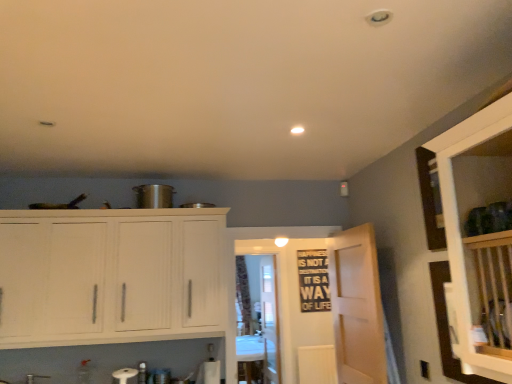
Describe the element at coordinates (269, 320) in the screenshot. I see `transparent glass door at center, placed as the first glass door when sorted from back to front` at that location.

You are a GUI agent. You are given a task and a screenshot of the screen. Output one action in this format:
    pyautogui.click(x=<x>, y=<y>)
    Task: Click on the transparent glass door at center, placed as the first glass door when sorted from back to front
    This screenshot has height=384, width=512.
    Given the screenshot: What is the action you would take?
    pyautogui.click(x=269, y=320)

What are the coordinates of `light wood door at center` in the screenshot? It's located at (357, 307).

The image size is (512, 384). I want to click on white wood cabinets at left, so click(x=110, y=276).

Find the location of a particular element. transparent glass door at center, which is counted as the 1th glass door, starting from the front is located at coordinates (264, 324).

Does light wood door at center have a smaller size compared to black matte bulletin board at center?

No, light wood door at center is not smaller than black matte bulletin board at center.

From the picture: Looking at their sizes, would you say light wood door at center is wider or thinner than black matte bulletin board at center?

In the image, light wood door at center appears to be wider than black matte bulletin board at center.

From a real-world perspective, is light wood door at center beneath black matte bulletin board at center?

Correct, in the physical world, light wood door at center is lower than black matte bulletin board at center.

From the image's perspective, which object appears higher, light wood door at center or black matte bulletin board at center?

From the image's view, light wood door at center is above.

Which is in front, transparent glass door at center, which is counted as the 1th glass door, starting from the front, or light wood door at center?

light wood door at center is in front.

From the image's perspective, between transparent glass door at center, arranged as the second glass door when viewed from the back, and light wood door at center, who is located below?

transparent glass door at center, arranged as the second glass door when viewed from the back, from the image's perspective.

Is transparent glass door at center, which is counted as the 1th glass door, starting from the front, turned away from light wood door at center?

That's not correct — transparent glass door at center, which is counted as the 1th glass door, starting from the front, is not looking away from light wood door at center.

Is transparent glass door at center, arranged as the second glass door when viewed from the back, shorter than light wood door at center?

Incorrect, the height of transparent glass door at center, arranged as the second glass door when viewed from the back, does not fall short of that of light wood door at center.

The height and width of the screenshot is (384, 512). I want to click on bulletin board behind the light wood door at center, so pos(313,280).

In terms of width, does black matte bulletin board at center look wider or thinner when compared to light wood door at center?

black matte bulletin board at center is thinner than light wood door at center.

Would you say black matte bulletin board at center is to the left or to the right of light wood door at center in the picture?

In the image, black matte bulletin board at center appears on the right side of light wood door at center.

What's the angular difference between black matte bulletin board at center and light wood door at center's facing directions?

90.9 degrees separate the facing orientations of black matte bulletin board at center and light wood door at center.

Is transparent glass door at center, placed as the first glass door when sorted from back to front, outside of light wood door at center?

Indeed, transparent glass door at center, placed as the first glass door when sorted from back to front, is completely outside light wood door at center.

What's the angular difference between transparent glass door at center, arranged as the second glass door when viewed from the front, and light wood door at center's facing directions?

They differ by 3.72 degrees in their facing directions.

Considering the relative sizes of transparent glass door at center, arranged as the second glass door when viewed from the front, and light wood door at center in the image provided, is transparent glass door at center, arranged as the second glass door when viewed from the front, taller than light wood door at center?

Correct, transparent glass door at center, arranged as the second glass door when viewed from the front, is much taller as light wood door at center.

From the image's perspective, which is below, transparent glass door at center, arranged as the second glass door when viewed from the front, or light wood door at center?

transparent glass door at center, arranged as the second glass door when viewed from the front.

Which object is closer to the camera taking this photo, light wood door at center or transparent glass door at center, arranged as the second glass door when viewed from the back?

light wood door at center is in front.

Which of these two, light wood door at center or transparent glass door at center, which is counted as the 1th glass door, starting from the front, stands shorter?

light wood door at center.

From the picture: Is light wood door at center thinner than transparent glass door at center, arranged as the second glass door when viewed from the back?

Correct, the width of light wood door at center is less than that of transparent glass door at center, arranged as the second glass door when viewed from the back.

From the image's perspective, between light wood door at center and transparent glass door at center, arranged as the second glass door when viewed from the back, who is located below?

transparent glass door at center, arranged as the second glass door when viewed from the back, from the image's perspective.

Considering the relative sizes of patterned fabric curtain at center and white wood cabinets at left in the image provided, is patterned fabric curtain at center shorter than white wood cabinets at left?

No.

Identify the location of cabinetry that appears above the patterned fabric curtain at center (from the image's perspective). The image size is (512, 384). (110, 276).

Considering the positions of objects patterned fabric curtain at center and white wood cabinets at left in the image provided, who is in front, patterned fabric curtain at center or white wood cabinets at left?

white wood cabinets at left is in front.

Based on the photo, would you say white wood cabinets at left is part of patterned fabric curtain at center's contents?

No, patterned fabric curtain at center does not contain white wood cabinets at left.

From a real-world perspective, which is physically below, white wood cabinets at left or transparent glass door at center, which is counted as the 1th glass door, starting from the front?

transparent glass door at center, which is counted as the 1th glass door, starting from the front, is physically lower.

From the image's perspective, is white wood cabinets at left on top of transparent glass door at center, which is counted as the 1th glass door, starting from the front?

Yes, from the image's perspective, white wood cabinets at left is above transparent glass door at center, which is counted as the 1th glass door, starting from the front.

Looking at this image, would you say white wood cabinets at left is a long distance from transparent glass door at center, arranged as the second glass door when viewed from the back?

Yes.

Is white wood cabinets at left outside of transparent glass door at center, which is counted as the 1th glass door, starting from the front?

Yes, white wood cabinets at left is located beyond the bounds of transparent glass door at center, which is counted as the 1th glass door, starting from the front.

The image size is (512, 384). Find the location of `bulletin board on the right side of light wood door at center`. bulletin board on the right side of light wood door at center is located at coordinates (313, 280).

The image size is (512, 384). In order to click on door positioned vertically above the transparent glass door at center, arranged as the second glass door when viewed from the back (from a real-world perspective) in this screenshot , I will do `click(357, 307)`.

Based on their spatial positions, is white wood cabinets at left or transparent glass door at center, placed as the first glass door when sorted from back to front, further from transparent glass door at center, which is counted as the 1th glass door, starting from the front?

white wood cabinets at left.

Which object lies nearer to the anchor point light wood door at center, transparent glass door at center, arranged as the second glass door when viewed from the front, or patterned fabric curtain at center?

transparent glass door at center, arranged as the second glass door when viewed from the front.

Estimate the real-world distances between objects in this image. Which object is further from light wood door at center, patterned fabric curtain at center or black matte bulletin board at center?

patterned fabric curtain at center is further to light wood door at center.

From the picture: Which object lies nearer to the anchor point white wood cabinets at left, patterned fabric curtain at center or transparent glass door at center, arranged as the second glass door when viewed from the back?

The object closer to white wood cabinets at left is transparent glass door at center, arranged as the second glass door when viewed from the back.

From the image, which object appears to be farther from light wood door at center, transparent glass door at center, arranged as the second glass door when viewed from the front, or white wood cabinets at left?

Among the two, transparent glass door at center, arranged as the second glass door when viewed from the front, is located further to light wood door at center.

Which object lies nearer to the anchor point black matte bulletin board at center, light wood door at center or white wood cabinets at left?

light wood door at center lies closer to black matte bulletin board at center than the other object.

When comparing their distances from black matte bulletin board at center, does transparent glass door at center, placed as the first glass door when sorted from back to front, or transparent glass door at center, which is counted as the 1th glass door, starting from the front, seem closer?

Based on the image, transparent glass door at center, placed as the first glass door when sorted from back to front, appears to be nearer to black matte bulletin board at center.

From the image, which object appears to be nearer to patterned fabric curtain at center, black matte bulletin board at center or transparent glass door at center, placed as the first glass door when sorted from back to front?

The object closer to patterned fabric curtain at center is transparent glass door at center, placed as the first glass door when sorted from back to front.

Where is `glass door between transparent glass door at center, which is counted as the 1th glass door, starting from the front, and patterned fabric curtain at center in the front-back direction`? This screenshot has height=384, width=512. glass door between transparent glass door at center, which is counted as the 1th glass door, starting from the front, and patterned fabric curtain at center in the front-back direction is located at coordinates point(269,320).

This screenshot has height=384, width=512. In order to click on cabinetry between light wood door at center and patterned fabric curtain at center along the z-axis in this screenshot , I will do `click(110, 276)`.

Image resolution: width=512 pixels, height=384 pixels. Find the location of `bulletin board between transparent glass door at center, arranged as the second glass door when viewed from the back, and patterned fabric curtain at center, along the z-axis`. bulletin board between transparent glass door at center, arranged as the second glass door when viewed from the back, and patterned fabric curtain at center, along the z-axis is located at coordinates (313, 280).

The image size is (512, 384). What are the coordinates of `bulletin board between light wood door at center and patterned fabric curtain at center from front to back` in the screenshot? It's located at (313, 280).